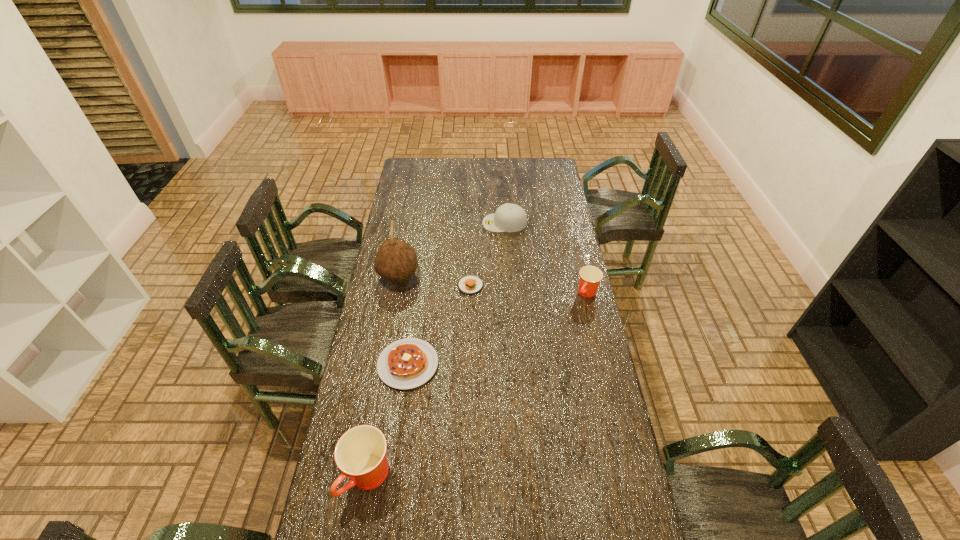
Identify the location of the nearest object. (360, 453).

I want to click on the taller cup, so click(360, 453).

The image size is (960, 540). Find the location of `the right cup`. the right cup is located at coordinates (590, 276).

Image resolution: width=960 pixels, height=540 pixels. Find the location of `the farther cup`. the farther cup is located at coordinates (590, 276).

Where is `the farthest object`? the farthest object is located at coordinates (508, 217).

Find the location of a particular element. The width and height of the screenshot is (960, 540). pancake is located at coordinates (407, 363).

Where is `the fifth tallest object`? the fifth tallest object is located at coordinates (407, 363).

I want to click on food, so click(470, 284).

Locate an element on the screen. Image resolution: width=960 pixels, height=540 pixels. coconut is located at coordinates (395, 260).

Where is `vacant area located 0.210m on the back of the second tallest object`? The height and width of the screenshot is (540, 960). vacant area located 0.210m on the back of the second tallest object is located at coordinates (384, 390).